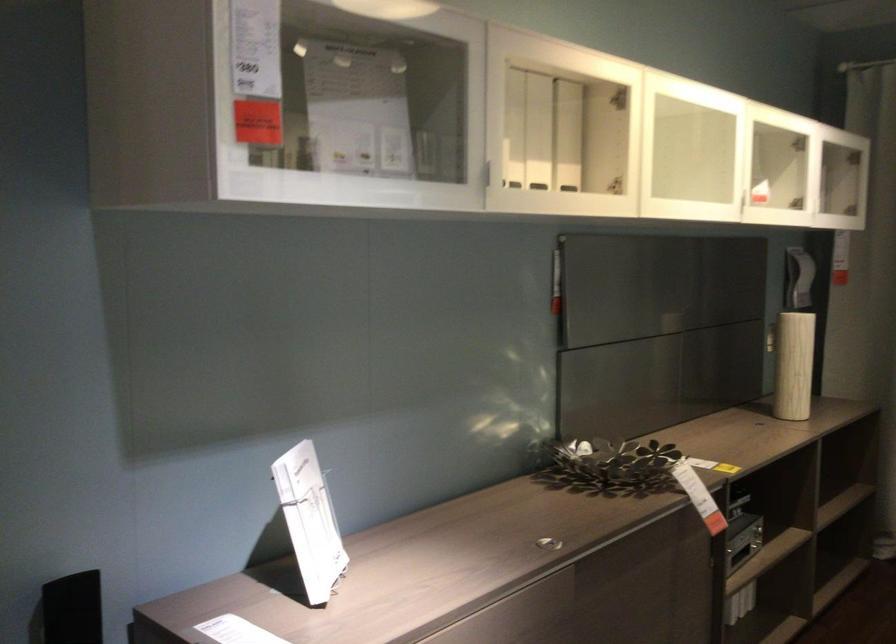
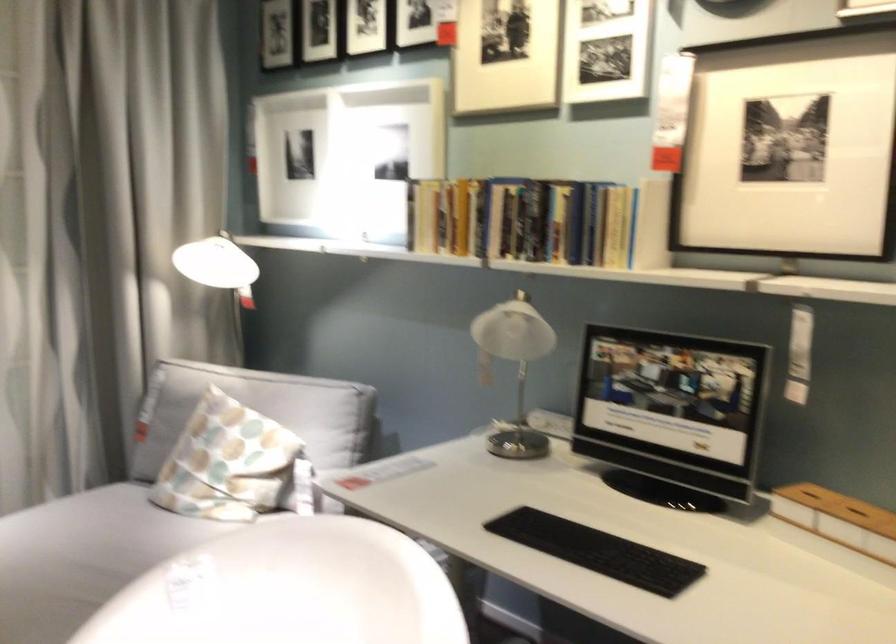
Question: The first image is from the beginning of the video and the second image is from the end. How did the camera likely rotate when shooting the video?

Choices:
 (A) Left
 (B) Right
 (C) Up
 (D) Down

Answer: (B)